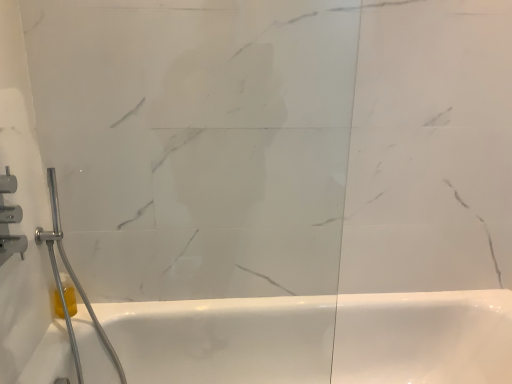
In the scene shown: Measure the distance between point [55,300] and camera.

Point [55,300] is 4.74 feet away from camera.

At what (x,y) coordinates should I click in order to perform the action: click on brushed metal shower at left, the 1th shower from the front. Please return your answer as a coordinate pair (x, y). The height and width of the screenshot is (384, 512). Looking at the image, I should click on (10, 221).

The height and width of the screenshot is (384, 512). I want to click on brushed metal shower at left, which appears as the first shower when viewed from the back, so click(x=71, y=278).

Would you consider transparent glass door at center to be distant from yellow translucent soap at lower left?

They are positioned close to each other.

Between transparent glass door at center and yellow translucent soap at lower left, which one has larger width?

Wider between the two is yellow translucent soap at lower left.

Looking at this image, could you tell me if transparent glass door at center is turned towards yellow translucent soap at lower left?

No.

Consider the image. Is yellow translucent soap at lower left situated inside transparent glass door at center or outside?

yellow translucent soap at lower left exists outside the volume of transparent glass door at center.

Can you confirm if yellow translucent soap at lower left is positioned to the left of transparent glass door at center?

Yes, yellow translucent soap at lower left is to the left of transparent glass door at center.

In the scene shown: Is yellow translucent soap at lower left taller or shorter than transparent glass door at center?

In the image, yellow translucent soap at lower left appears to be shorter than transparent glass door at center.

Between yellow translucent soap at lower left and brushed metal shower at left, which appears as the first shower when viewed from the back, which one is positioned in front?

brushed metal shower at left, which appears as the first shower when viewed from the back, is closer to the camera.

Which object is wider, yellow translucent soap at lower left or brushed metal shower at left, which appears as the first shower when viewed from the back?

Wider between the two is brushed metal shower at left, which appears as the first shower when viewed from the back.

Is yellow translucent soap at lower left to the left or to the right of brushed metal shower at left, which appears as the first shower when viewed from the back, in the image?

Based on their positions, yellow translucent soap at lower left is located to the left of brushed metal shower at left, which appears as the first shower when viewed from the back.

Does yellow translucent soap at lower left have a greater height compared to brushed metal shower at left, which appears as the first shower when viewed from the back?

Incorrect, the height of yellow translucent soap at lower left is not larger of that of brushed metal shower at left, which appears as the first shower when viewed from the back.

Which of these two, brushed metal shower at left, positioned as the 2th shower in back-to-front order, or yellow translucent soap at lower left, stands shorter?

yellow translucent soap at lower left.

From a real-world perspective, which is physically above, brushed metal shower at left, the 1th shower from the front, or yellow translucent soap at lower left?

From a 3D spatial view, brushed metal shower at left, the 1th shower from the front, is above.

From the image's perspective, is brushed metal shower at left, positioned as the 2th shower in back-to-front order, located beneath yellow translucent soap at lower left?

No.

Considering the sizes of brushed metal shower at left, the 1th shower from the front, and yellow translucent soap at lower left in the image, is brushed metal shower at left, the 1th shower from the front, wider or thinner than yellow translucent soap at lower left?

Considering their sizes, brushed metal shower at left, the 1th shower from the front, looks slimmer than yellow translucent soap at lower left.

Is transparent glass door at center located outside brushed metal shower at left, the 1th shower from the front?

Absolutely, transparent glass door at center is external to brushed metal shower at left, the 1th shower from the front.

Can you confirm if transparent glass door at center is smaller than brushed metal shower at left, positioned as the 2th shower in back-to-front order?

No, transparent glass door at center is not smaller than brushed metal shower at left, positioned as the 2th shower in back-to-front order.

Which object is further away from the camera taking this photo, transparent glass door at center or brushed metal shower at left, positioned as the 2th shower in back-to-front order?

brushed metal shower at left, positioned as the 2th shower in back-to-front order, is behind.

Who is shorter, yellow translucent soap at lower left or brushed metal shower at left, the 1th shower from the front?

yellow translucent soap at lower left is shorter.

Considering the relative sizes of yellow translucent soap at lower left and brushed metal shower at left, positioned as the 2th shower in back-to-front order, in the image provided, is yellow translucent soap at lower left wider than brushed metal shower at left, positioned as the 2th shower in back-to-front order,?

Indeed, yellow translucent soap at lower left has a greater width compared to brushed metal shower at left, positioned as the 2th shower in back-to-front order.

Does yellow translucent soap at lower left come behind brushed metal shower at left, the 1th shower from the front?

Yes, it is behind brushed metal shower at left, the 1th shower from the front.

Can you confirm if yellow translucent soap at lower left is smaller than brushed metal shower at left, the 1th shower from the front?

Yes, yellow translucent soap at lower left is smaller than brushed metal shower at left, the 1th shower from the front.

From a real-world perspective, who is located lower, brushed metal shower at left, which is the second shower in front-to-back order, or brushed metal shower at left, positioned as the 2th shower in back-to-front order?

In real-world perspective, brushed metal shower at left, which is the second shower in front-to-back order, is lower.

Locate an element on the screen. This screenshot has width=512, height=384. shower located behind the brushed metal shower at left, the 1th shower from the front is located at coordinates (71, 278).

Is there a large distance between brushed metal shower at left, which appears as the first shower when viewed from the back, and brushed metal shower at left, the 1th shower from the front?

That's not correct — brushed metal shower at left, which appears as the first shower when viewed from the back, is a little close to brushed metal shower at left, the 1th shower from the front.

Who is shorter, brushed metal shower at left, which appears as the first shower when viewed from the back, or brushed metal shower at left, the 1th shower from the front?

brushed metal shower at left, the 1th shower from the front.

Find the location of a particular element. The height and width of the screenshot is (384, 512). toiletry lying on the left of transparent glass door at center is located at coordinates (69, 293).

I want to click on glass door above the yellow translucent soap at lower left (from a real-world perspective), so click(197, 142).

Considering their positions, is brushed metal shower at left, which is the second shower in front-to-back order, positioned closer to transparent glass door at center than brushed metal shower at left, positioned as the 2th shower in back-to-front order?

The object closer to transparent glass door at center is brushed metal shower at left, which is the second shower in front-to-back order.

Looking at the image, which one is located further to brushed metal shower at left, which appears as the first shower when viewed from the back, transparent glass door at center or yellow translucent soap at lower left?

transparent glass door at center.

Considering their positions, is transparent glass door at center positioned closer to brushed metal shower at left, positioned as the 2th shower in back-to-front order, than brushed metal shower at left, which appears as the first shower when viewed from the back?

brushed metal shower at left, which appears as the first shower when viewed from the back, is positioned closer to the anchor brushed metal shower at left, positioned as the 2th shower in back-to-front order.

Based on their spatial positions, is brushed metal shower at left, positioned as the 2th shower in back-to-front order, or yellow translucent soap at lower left further from transparent glass door at center?

yellow translucent soap at lower left lies further to transparent glass door at center than the other object.

From the image, which object appears to be nearer to yellow translucent soap at lower left, brushed metal shower at left, which is the second shower in front-to-back order, or transparent glass door at center?

brushed metal shower at left, which is the second shower in front-to-back order.

Looking at the image, which one is located closer to yellow translucent soap at lower left, brushed metal shower at left, the 1th shower from the front, or brushed metal shower at left, which is the second shower in front-to-back order?

Based on the image, brushed metal shower at left, which is the second shower in front-to-back order, appears to be nearer to yellow translucent soap at lower left.

From the image, which object appears to be nearer to transparent glass door at center, yellow translucent soap at lower left or brushed metal shower at left, which is the second shower in front-to-back order?

brushed metal shower at left, which is the second shower in front-to-back order, lies closer to transparent glass door at center than the other object.

Based on their spatial positions, is yellow translucent soap at lower left or transparent glass door at center closer to brushed metal shower at left, which is the second shower in front-to-back order?

yellow translucent soap at lower left lies closer to brushed metal shower at left, which is the second shower in front-to-back order, than the other object.

The width and height of the screenshot is (512, 384). Identify the location of shower between brushed metal shower at left, the 1th shower from the front, and transparent glass door at center. (71, 278).

This screenshot has width=512, height=384. I want to click on shower between brushed metal shower at left, positioned as the 2th shower in back-to-front order, and yellow translucent soap at lower left from front to back, so click(x=71, y=278).